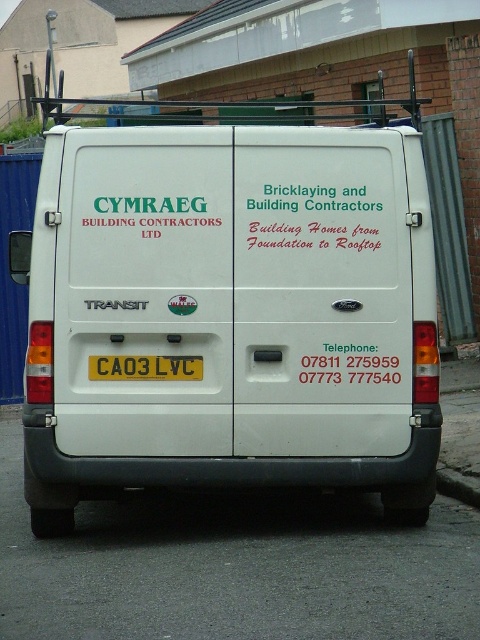
You are a delivery driver who needs to read the license plate of the white Ford Transit van. You notice the yellow matte license plate at center and the gray concrete curb at lower right. Which object is smaller in size?

The yellow matte license plate at center has a smaller size compared to the gray concrete curb at lower right.

You are standing in front of the white Ford Transit van and want to touch both points on the van. Which point should you reach for first, point at coordinate (119, 397) or point at coordinate (448, 486)?

You should reach for point at coordinate (119, 397) first because it is closer to you than point at coordinate (448, 486).

You are a delivery driver who needs to read the license plate of the van. You see the yellow matte license plate at center and the gray concrete curb at lower right. Which object is closer to the left side of the van?

The yellow matte license plate at center is positioned on the left side of the gray concrete curb at lower right, so the yellow matte license plate at center is closer to the left side of the van.